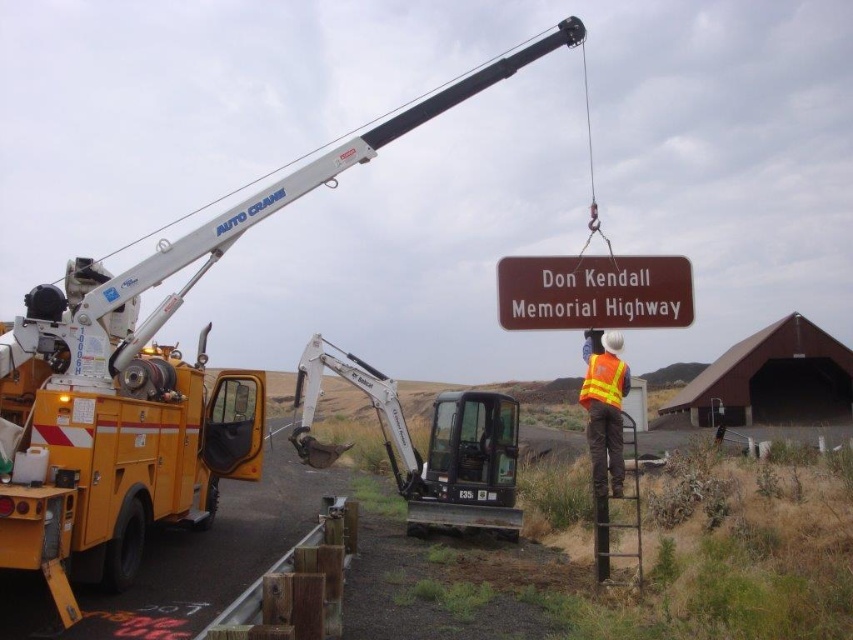
Between reflective orange vest at center and reflective orange safety vest at center, which one appears on the left side from the viewer's perspective?

reflective orange safety vest at center is more to the left.

Is point (604, 392) positioned behind point (599, 401)?

That is True.

I want to click on reflective orange vest at center, so click(604, 408).

Between gray metallic excavator at center and reflective orange vest at center, which one has less height?

Standing shorter between the two is reflective orange vest at center.

Who is more distant from viewer, [310,435] or [585,362]?

Positioned behind is point [310,435].

Find the location of a particular element. gray metallic excavator at center is located at coordinates (427, 445).

Which of these two, brownmaterial/texturesign at center or reflective orange safety vest at center, stands taller?

brownmaterial/texturesign at center

Does brownmaterial/texturesign at center lie in front of reflective orange safety vest at center?

That is False.

Who is more forward, (570, 280) or (602, 352)?

Point (602, 352) is in front.

What are the coordinates of `brownmaterial/texturesign at center` in the screenshot? It's located at pyautogui.click(x=593, y=291).